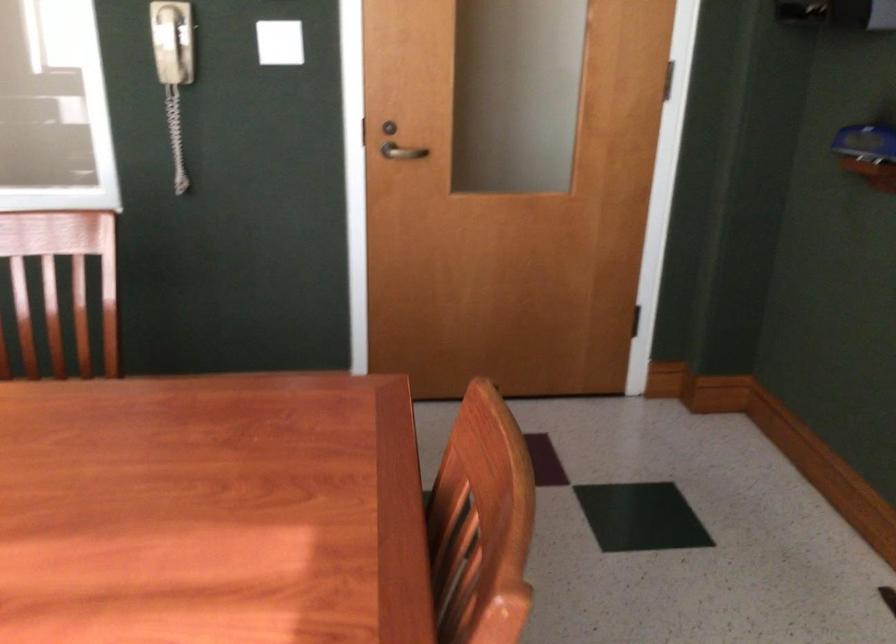
This screenshot has width=896, height=644. What do you see at coordinates (401, 152) in the screenshot? I see `the metal door handle` at bounding box center [401, 152].